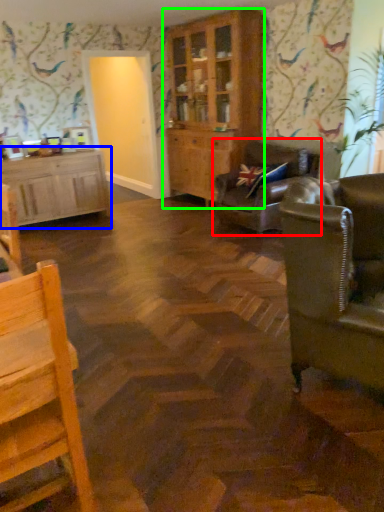
Question: Which object is the closest to the studio couch (highlighted by a red box)? Choose among these: cabinetry (highlighted by a blue box) or cabinetry (highlighted by a green box).

Choices:
 (A) cabinetry
 (B) cabinetry

Answer: (B)